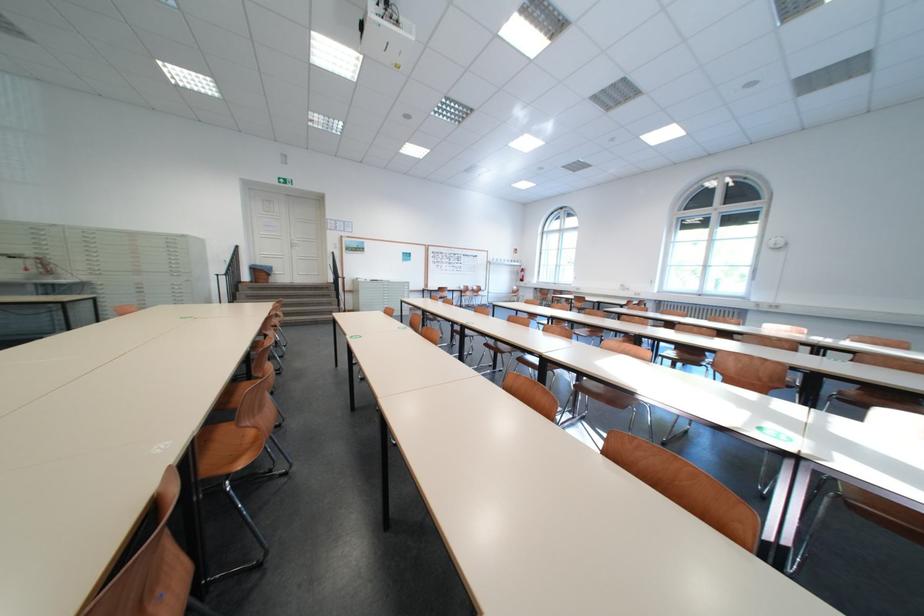
This screenshot has height=616, width=924. What do you see at coordinates (295, 245) in the screenshot? I see `the white door handle` at bounding box center [295, 245].